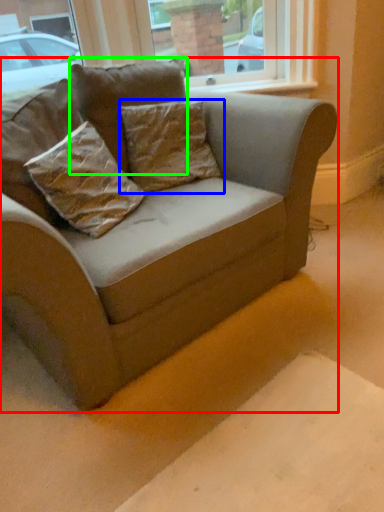
Question: Which object is positioned closest to studio couch (highlighted by a red box)? Select from pillow (highlighted by a blue box) and pillow (highlighted by a green box).

Choices:
 (A) pillow
 (B) pillow

Answer: (A)